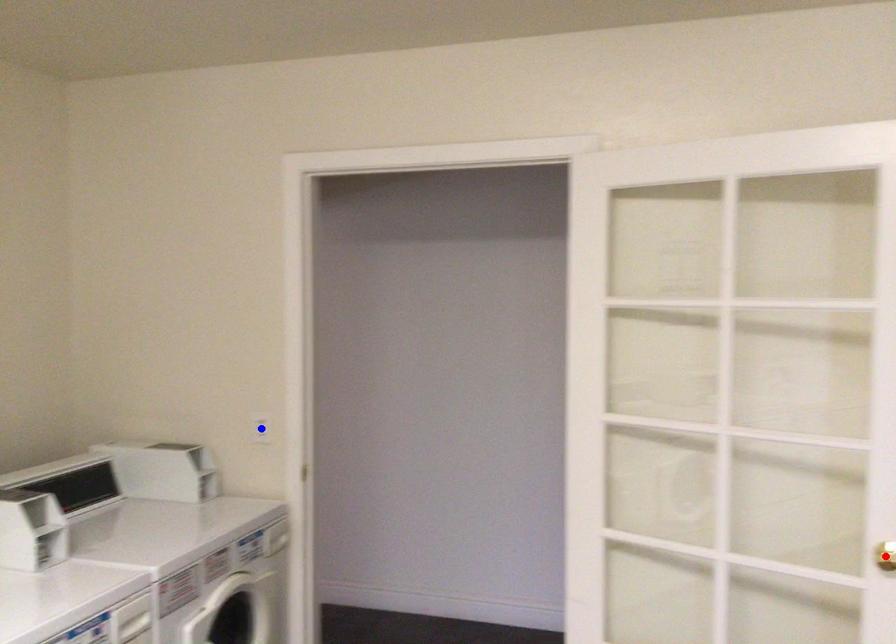
Question: In the image, two points are highlighted. Which point is nearer to the camera? Reply with the corresponding letter.

Choices:
 (A) blue point
 (B) red point

Answer: (B)